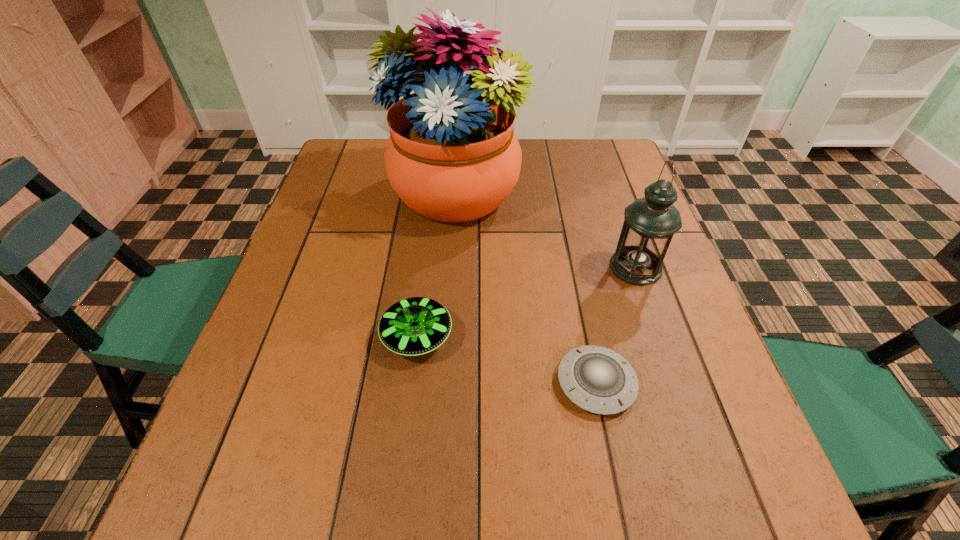
Locate an element on the screen. The width and height of the screenshot is (960, 540). vacant region located on the back of the third tallest object is located at coordinates (422, 292).

Find the location of a particular element. vacant point located on the left of the shortest object is located at coordinates (444, 383).

The height and width of the screenshot is (540, 960). In order to click on object that is positioned at the far edge in this screenshot , I will do `click(452, 156)`.

Where is `oil lamp that is at the right edge`? This screenshot has width=960, height=540. oil lamp that is at the right edge is located at coordinates (650, 222).

Locate an element on the screen. saucer present at the right edge is located at coordinates (597, 379).

This screenshot has width=960, height=540. I want to click on vacant area at the far edge, so (x=527, y=152).

In the image, there is a desktop. What are the coordinates of `vacant space at the near edge` in the screenshot? It's located at (582, 497).

What are the coordinates of `vacant area at the left edge` in the screenshot? It's located at (298, 258).

Find the location of a particular element. This screenshot has width=960, height=540. vacant space at the right edge of the desktop is located at coordinates (695, 319).

This screenshot has width=960, height=540. In order to click on free space at the far left corner of the desktop in this screenshot , I will do `click(351, 145)`.